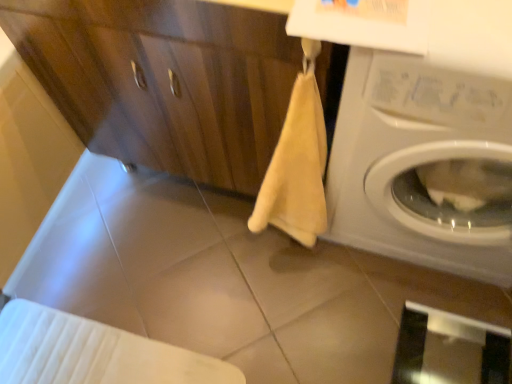
The image size is (512, 384). I want to click on vacant space in between beige matte tile at center and transparent glass screen door at lower right, so click(x=312, y=325).